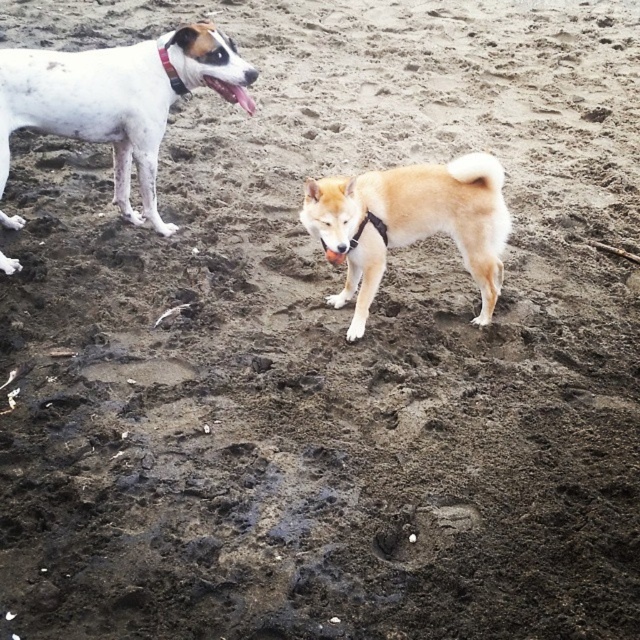
You are standing at the point labeled point [65,64]. You want to throw a ball to your friend who is 3.11 meters away from you. Is your friend located at the same spot as you?

The distance between point [65,64] and the viewer is 3.11 meters, so your friend is not at the same spot as you since they are 3.11 meters away.

You are a photographer trying to capture both the light brown fur at center and the black fabric neckband at upper left in a single frame. Since you want to ensure both are visible, which object should you focus on first to maintain clarity, considering their sizes?

The light brown fur at center is larger in size than the black fabric neckband at upper left, so you should focus on the light brown fur at center first to ensure it remains clear in the photo.